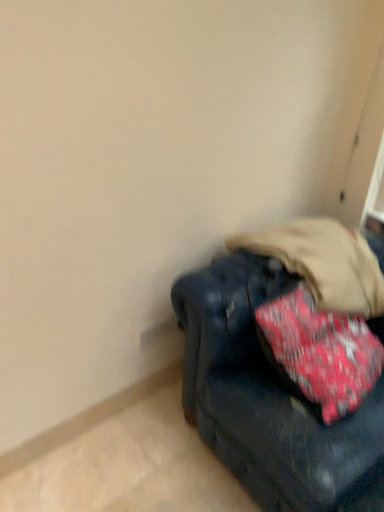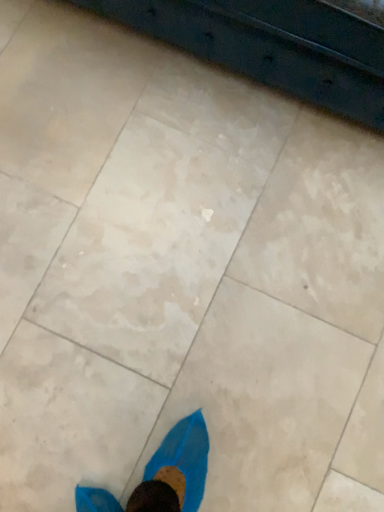
Question: Which way did the camera rotate in the video?

Choices:
 (A) rotated downward
 (B) rotated upward

Answer: (A)